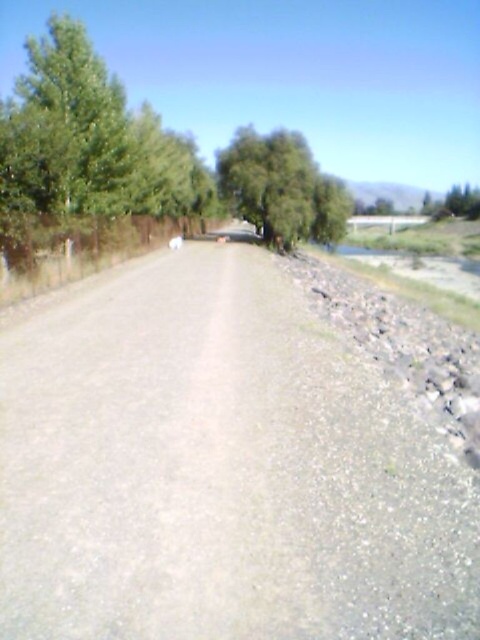
Find the location of a particular element. The width and height of the screenshot is (480, 640). gray gravel dirt track at center is located at coordinates (220, 470).

Who is more distant from viewer, (215, 456) or (259, 173)?

Point (259, 173)

What do you see at coordinates (220, 470) in the screenshot? The width and height of the screenshot is (480, 640). I see `gray gravel dirt track at center` at bounding box center [220, 470].

Locate an element on the screen. gray gravel dirt track at center is located at coordinates (220, 470).